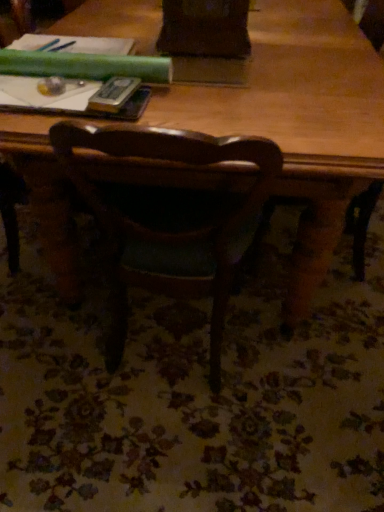
Question: Considering the relative positions of metallic silver paperback book at upper center and wooden table at center in the image provided, is metallic silver paperback book at upper center to the left or to the right of wooden table at center?

Choices:
 (A) left
 (B) right

Answer: (A)

Question: From a real-world perspective, is metallic silver paperback book at upper center physically located above or below wooden table at center?

Choices:
 (A) above
 (B) below

Answer: (A)

Question: Estimate the real-world distances between objects in this image. Which object is farther from the hardcover book at upper left?

Choices:
 (A) wooden table at center
 (B) metallic silver paperback book at upper center

Answer: (A)

Question: Based on their relative distances, which object is nearer to the hardcover book at upper left?

Choices:
 (A) wooden table at center
 (B) metallic silver paperback book at upper center

Answer: (B)